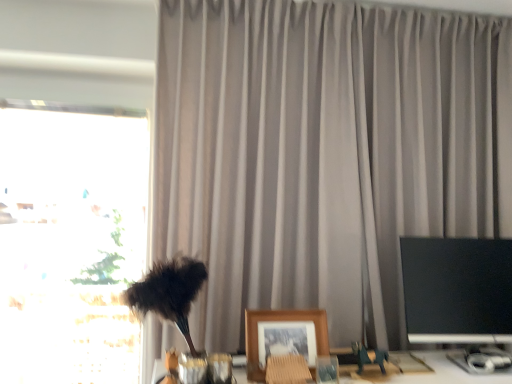
Where is `blank space above transparent glass window at left (from a real-world perspective)`? The image size is (512, 384). blank space above transparent glass window at left (from a real-world perspective) is located at coordinates (77, 90).